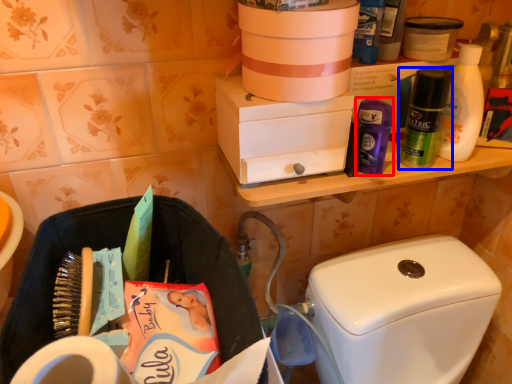
Question: Which object appears farthest to the camera in this image, toiletry (highlighted by a red box) or toiletry (highlighted by a blue box)?

Choices:
 (A) toiletry
 (B) toiletry

Answer: (A)